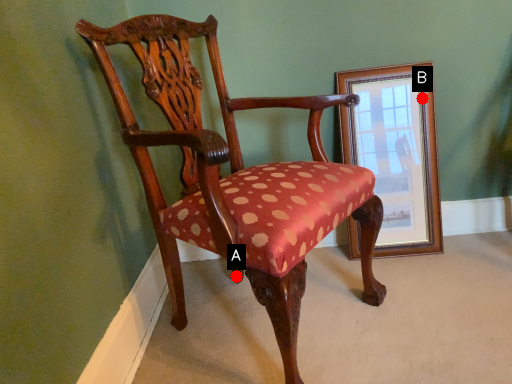
Question: Two points are circled on the image, labeled by A and B beside each circle. Which point appears farthest from the camera in this image?

Choices:
 (A) A is further
 (B) B is further

Answer: (B)